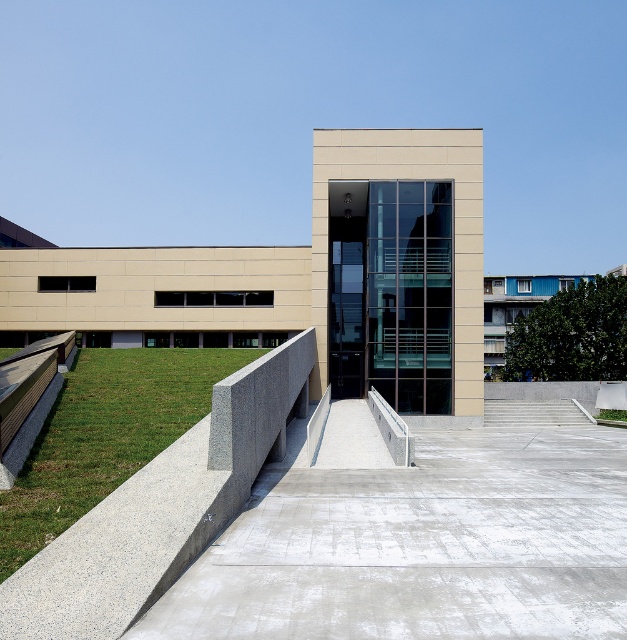
Question: Is the position of gray concrete at center less distant than that of green grass at lower left?

Choices:
 (A) yes
 (B) no

Answer: (A)

Question: Is the position of green grass at lower left less distant than that of concrete stairs at center?

Choices:
 (A) yes
 (B) no

Answer: (A)

Question: Which point is farther to the camera?

Choices:
 (A) (162, 372)
 (B) (485, 408)
 (C) (515, 472)

Answer: (B)

Question: Which point is closer to the camera?

Choices:
 (A) green grass at lower left
 (B) gray concrete at center
 (C) concrete stairs at center

Answer: (B)

Question: From the image, what is the correct spatial relationship of gray concrete at center in relation to concrete stairs at center?

Choices:
 (A) right
 (B) left

Answer: (B)

Question: Which of the following is the farthest from the observer?

Choices:
 (A) gray concrete at center
 (B) concrete stairs at center

Answer: (B)